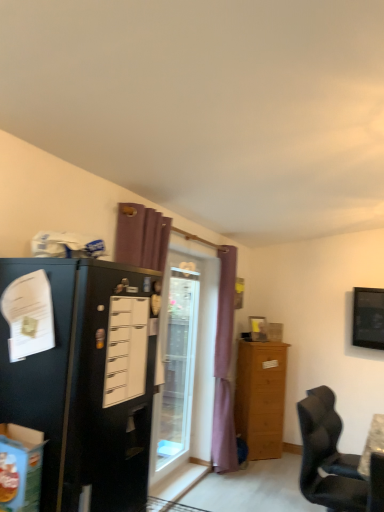
Question: From a real-world perspective, is black matte refrigerator at left on top of black glossy tv at upper right?

Choices:
 (A) yes
 (B) no

Answer: (B)

Question: Does black matte refrigerator at left have a larger size compared to black glossy tv at upper right?

Choices:
 (A) no
 (B) yes

Answer: (B)

Question: Is black matte refrigerator at left taller than black glossy tv at upper right?

Choices:
 (A) no
 (B) yes

Answer: (B)

Question: Can you confirm if black matte refrigerator at left is positioned to the left of black glossy tv at upper right?

Choices:
 (A) yes
 (B) no

Answer: (A)

Question: Is black glossy tv at upper right at the back of black matte refrigerator at left?

Choices:
 (A) yes
 (B) no

Answer: (B)

Question: Does black matte refrigerator at left come behind black glossy tv at upper right?

Choices:
 (A) no
 (B) yes

Answer: (A)

Question: Does purple fabric curtain at center appear on the right side of transparent glass door at center?

Choices:
 (A) yes
 (B) no

Answer: (A)

Question: Does purple fabric curtain at center have a lesser width compared to transparent glass door at center?

Choices:
 (A) yes
 (B) no

Answer: (B)

Question: Is purple fabric curtain at center oriented towards transparent glass door at center?

Choices:
 (A) no
 (B) yes

Answer: (A)

Question: Is purple fabric curtain at center outside of transparent glass door at center?

Choices:
 (A) no
 (B) yes

Answer: (B)

Question: Is purple fabric curtain at center facing away from transparent glass door at center?

Choices:
 (A) no
 (B) yes

Answer: (A)

Question: Is purple fabric curtain at center closer to camera compared to transparent glass door at center?

Choices:
 (A) no
 (B) yes

Answer: (A)

Question: Is light brown wooden cabinet at right positioned behind black matte refrigerator at left?

Choices:
 (A) no
 (B) yes

Answer: (B)